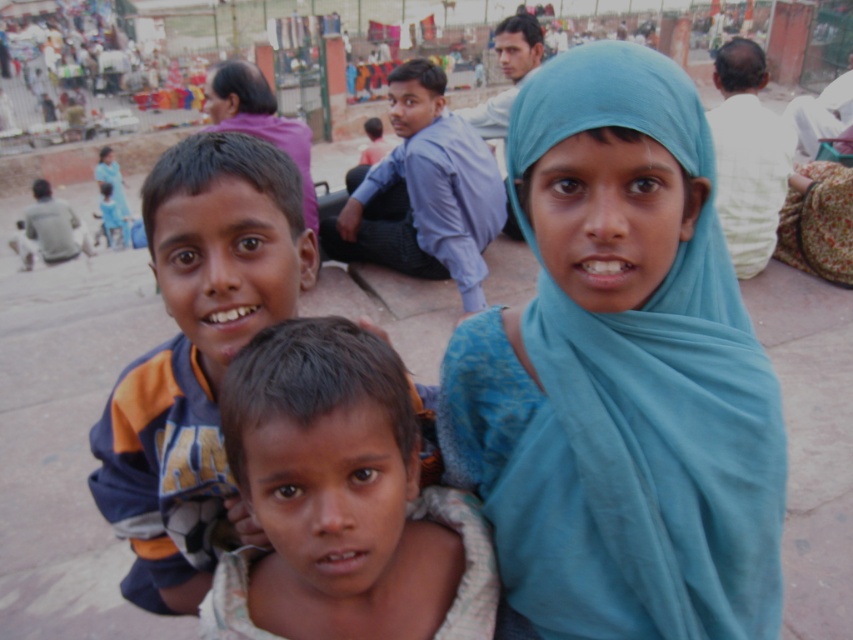
Is point (334, 529) behind point (274, 216)?

No, it is not.

Who is more forward, (x=341, y=529) or (x=206, y=276)?

Point (x=341, y=529)

Where is `light brown skin child at center`? The image size is (853, 640). light brown skin child at center is located at coordinates (341, 500).

Does blue fabric headscarf at upper right appear under blue cotton shirt at center?

Yes.

Is blue fabric headscarf at upper right taller than blue cotton shirt at center?

In fact, blue fabric headscarf at upper right may be shorter than blue cotton shirt at center.

The image size is (853, 640). What are the coordinates of `blue fabric headscarf at upper right` in the screenshot? It's located at coord(619,376).

Locate an element on the screen. Image resolution: width=853 pixels, height=640 pixels. blue fabric headscarf at upper right is located at coordinates (619, 376).

Is blue fabric headscarf at upper right below orange and gray hoodie at center?

No, blue fabric headscarf at upper right is not below orange and gray hoodie at center.

You are a GUI agent. You are given a task and a screenshot of the screen. Output one action in this format:
    pyautogui.click(x=<x>, y=<y>)
    Task: Click on the blue fabric headscarf at upper right
    Image resolution: width=853 pixels, height=640 pixels.
    Given the screenshot: What is the action you would take?
    pyautogui.click(x=619, y=376)

Who is more distant from viewer, [718,570] or [254,320]?

The point [718,570] is behind.

The height and width of the screenshot is (640, 853). What are the coordinates of `blue fabric headscarf at upper right` in the screenshot? It's located at (619, 376).